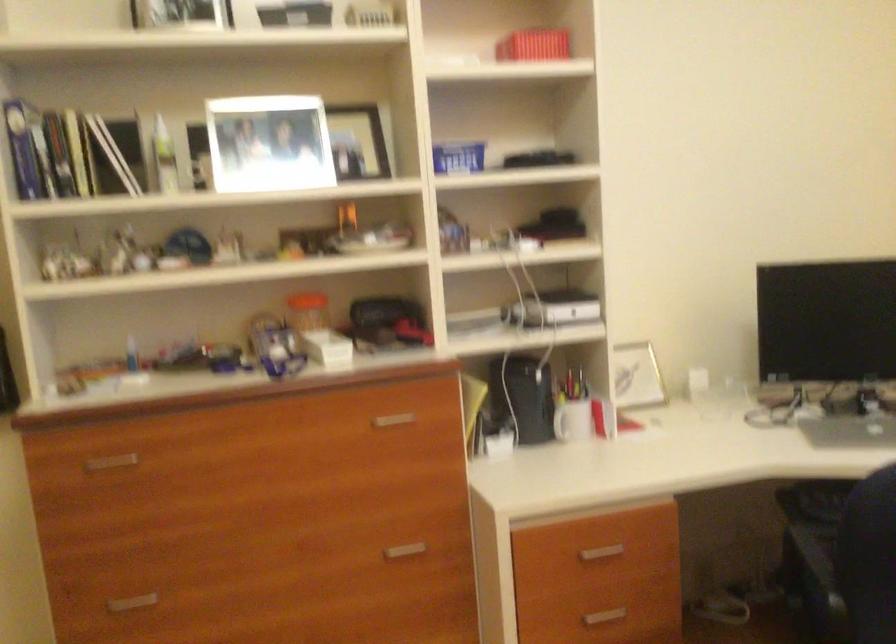
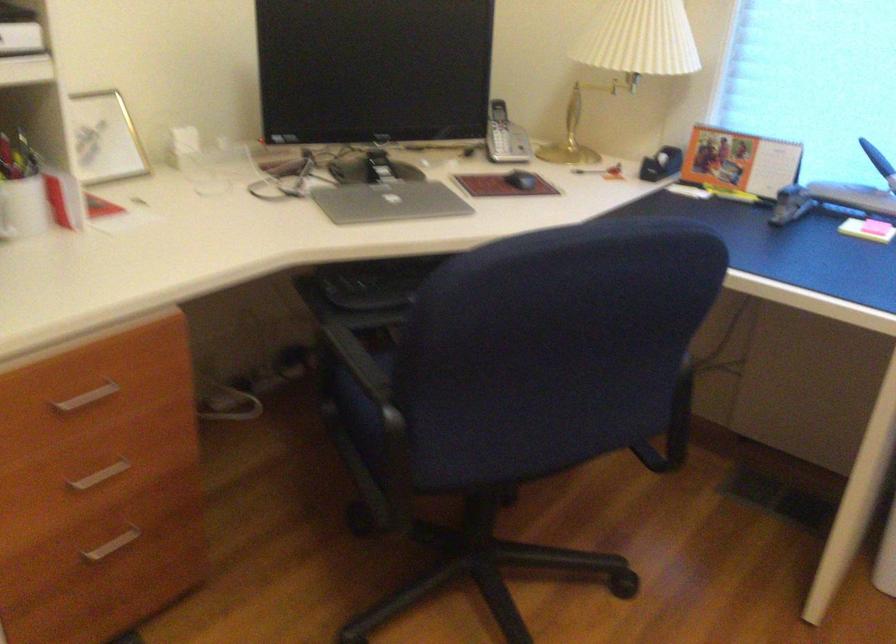
The point at (576,421) is marked in the first image. Where is the corresponding point in the second image?

(23, 207)